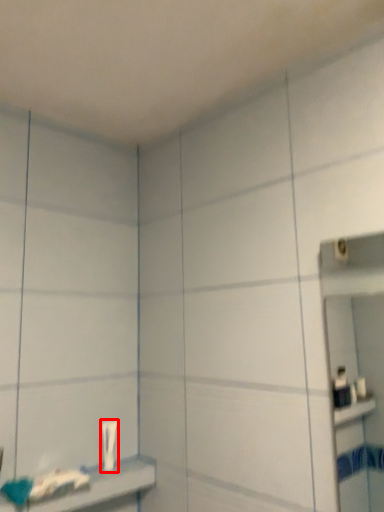
Question: From the image, what is the correct spatial relationship of toothpaste (annotated by the red box) in relation to shelf?

Choices:
 (A) right
 (B) left

Answer: (A)